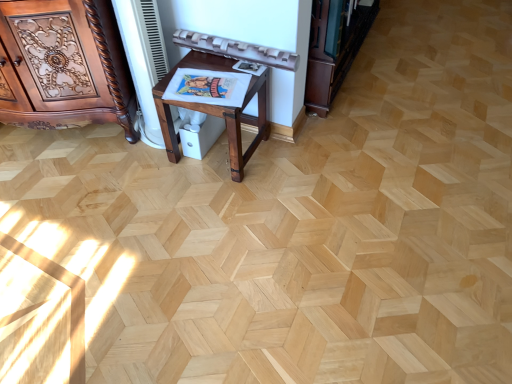
This screenshot has height=384, width=512. Identify the location of empty space that is to the right of mahogany wood table at center. (292, 165).